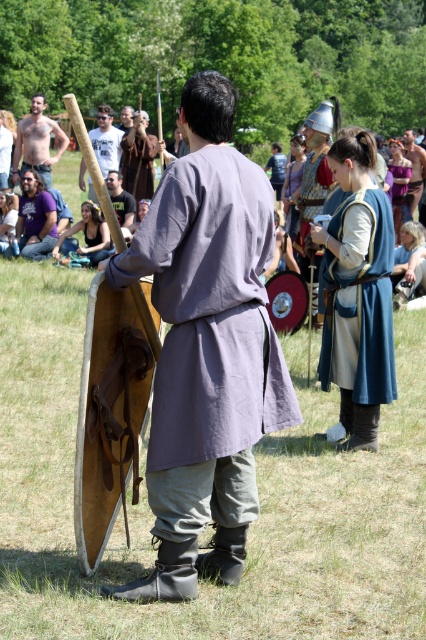
Who is more forward, (40,225) or (95,156)?

Point (95,156) is in front.

Between purple cotton shirt at center and wooden staff at center, which one has more height?

With more height is purple cotton shirt at center.

Where is `purple cotton shirt at center`? purple cotton shirt at center is located at coordinates pos(36,218).

The image size is (426, 640). Find the location of `purple cotton shirt at center`. purple cotton shirt at center is located at coordinates (36, 218).

The image size is (426, 640). I want to click on matte gray tunic at center, so click(207, 346).

How much distance is there between matte gray tunic at center and shiny silver sword at upper left?

matte gray tunic at center is 11.23 meters away from shiny silver sword at upper left.

Between point (215, 349) and point (14, 164), which one is positioned in front?

Point (215, 349) is more forward.

Where is `matte gray tunic at center`? The width and height of the screenshot is (426, 640). matte gray tunic at center is located at coordinates (207, 346).

Locate an element on the screen. The width and height of the screenshot is (426, 640). blue velvet tunic at center is located at coordinates (374, 344).

Between blue velvet tunic at center and blue denim shirt at center, which one is positioned higher?

Positioned higher is blue denim shirt at center.

Is point (370, 291) positioned behind point (278, 189)?

No, it is in front of (278, 189).

At what (x,y) coordinates should I click in order to perform the action: click on blue velvet tunic at center. Please return your answer as a coordinate pair (x, y). Looking at the image, I should click on (374, 344).